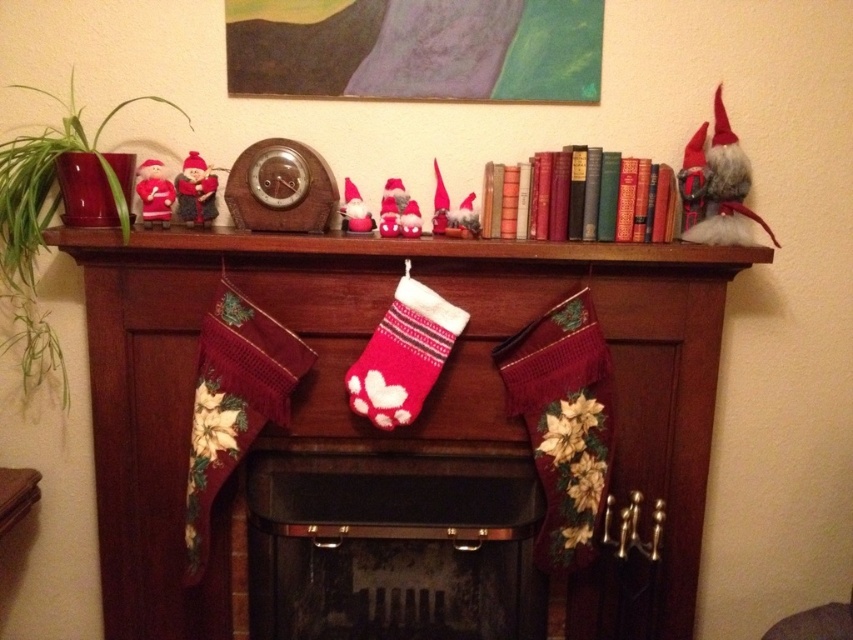
You are a delivery person placing a 12 inch long package on the Christmas mantel. The package must be placed between the knitted stockings at center and the matte purple painting at upper center. Is there enough space for the package?

The distance between the knitted stockings at center and the matte purple painting at upper center is 21.10 inches. Since the package is 12 inches long, there is sufficient space to place it between them.

You are a guest at a Christmas party and want to take a photo of the knitted stockings at center and the knitted wool stockings at center. Which one is closer to you?

The knitted stockings at center is closer to you because the knitted wool stockings at center is behind it.